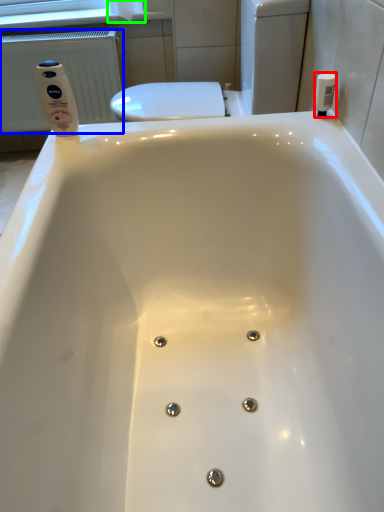
Question: Which object is positioned farthest from toiletry (highlighted by a red box)? Select from radiator (highlighted by a blue box) and toilet paper (highlighted by a green box).

Choices:
 (A) radiator
 (B) toilet paper

Answer: (A)